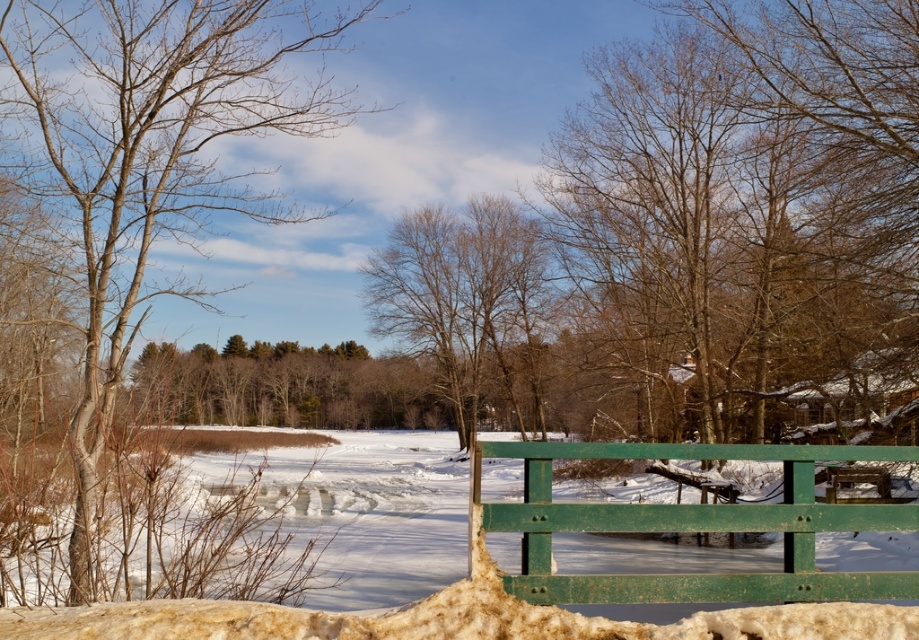
Question: Which of the following is the farthest from the observer?

Choices:
 (A) brown bark tree at left
 (B) green painted wood bench at center

Answer: (A)

Question: Estimate the real-world distances between objects in this image. Which object is farther from the bare brown tree at center?

Choices:
 (A) brown bark tree at left
 (B) green painted wood bench at center

Answer: (B)

Question: In this image, where is brown bark tree at left located relative to white fluffy snow at center?

Choices:
 (A) right
 (B) left

Answer: (B)

Question: Is white fluffy snow at center in front of green painted wood bench at center?

Choices:
 (A) no
 (B) yes

Answer: (B)

Question: Can you confirm if brown bark tree at left is positioned to the left of bare brown tree at center?

Choices:
 (A) yes
 (B) no

Answer: (A)

Question: Which point is closer to the camera?

Choices:
 (A) bare brown tree at center
 (B) white fluffy snow at center

Answer: (B)